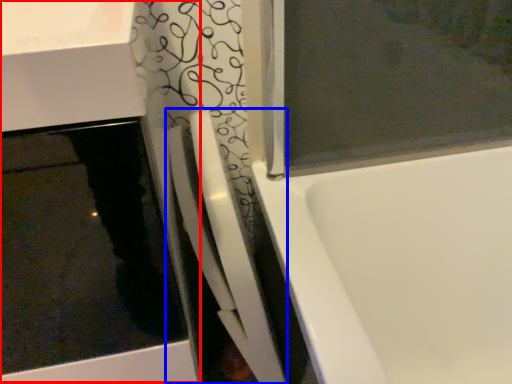
Question: Which object is further to the camera taking this photo, sink (highlighted by a red box) or shower door (highlighted by a blue box)?

Choices:
 (A) sink
 (B) shower door

Answer: (B)